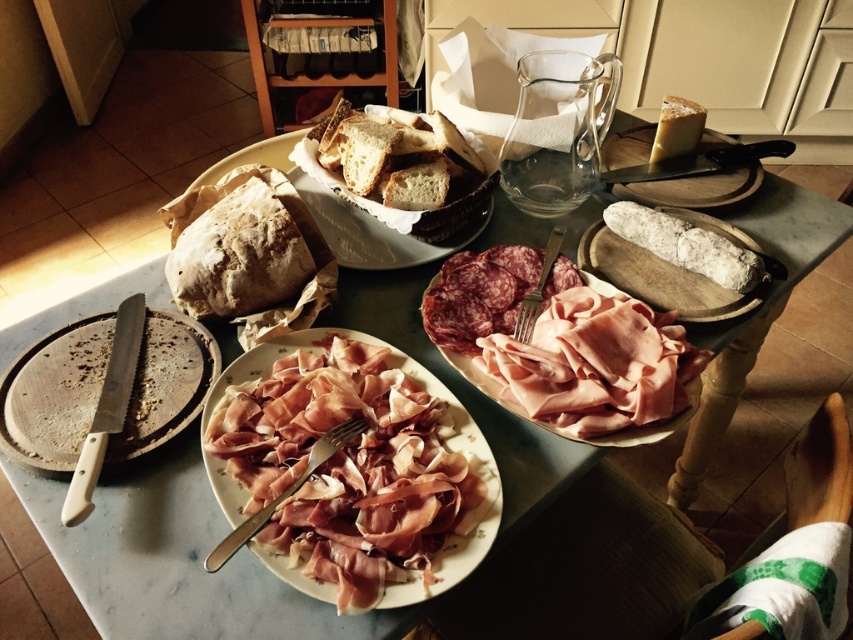
Question: Which of the following is the farthest from the observer?

Choices:
 (A) white felt-covered cheese at center-right
 (B) pink glossy ham at center
 (C) baked brown crusty bread at left
 (D) baked clay bread at center

Answer: (D)

Question: Is baked clay bread at center bigger than white felt-covered cheese at center-right?

Choices:
 (A) yes
 (B) no

Answer: (A)

Question: Is wooden cutting board at lower left positioned before white crusty bread at center?

Choices:
 (A) no
 (B) yes

Answer: (B)

Question: Estimate the real-world distances between objects in this image. Which object is farther from the baked brown crusty bread at left?

Choices:
 (A) baked clay bread at center
 (B) white felt-covered cheese at center-right
 (C) pink glossy meat at center

Answer: (B)

Question: Which object appears closest to the camera in this image?

Choices:
 (A) pink glossy meat at center
 (B) dark red cured meat at center
 (C) baked brown crusty bread at left
 (D) baked clay bread at center

Answer: (A)

Question: Does pink glossy ham at center appear under pink glossy meat at center?

Choices:
 (A) no
 (B) yes

Answer: (B)